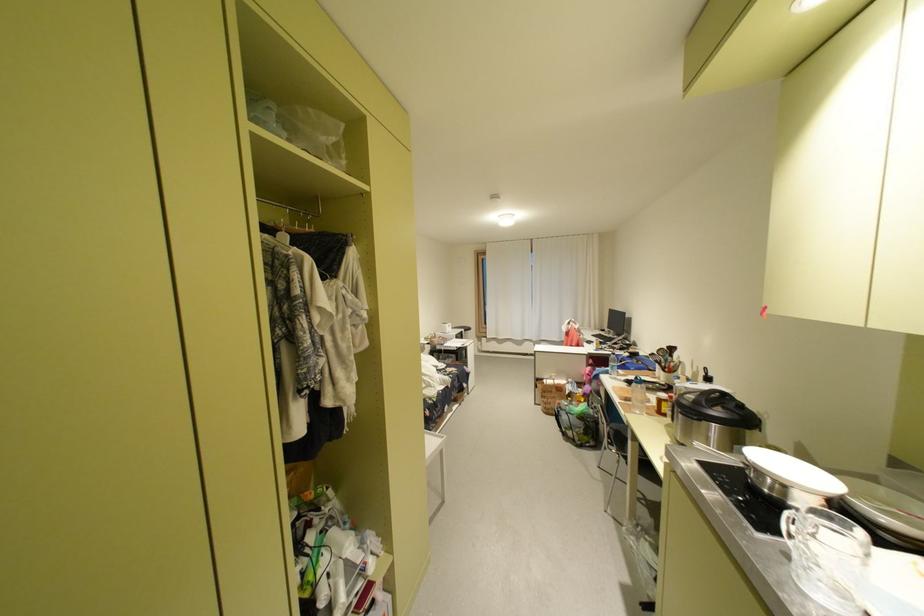
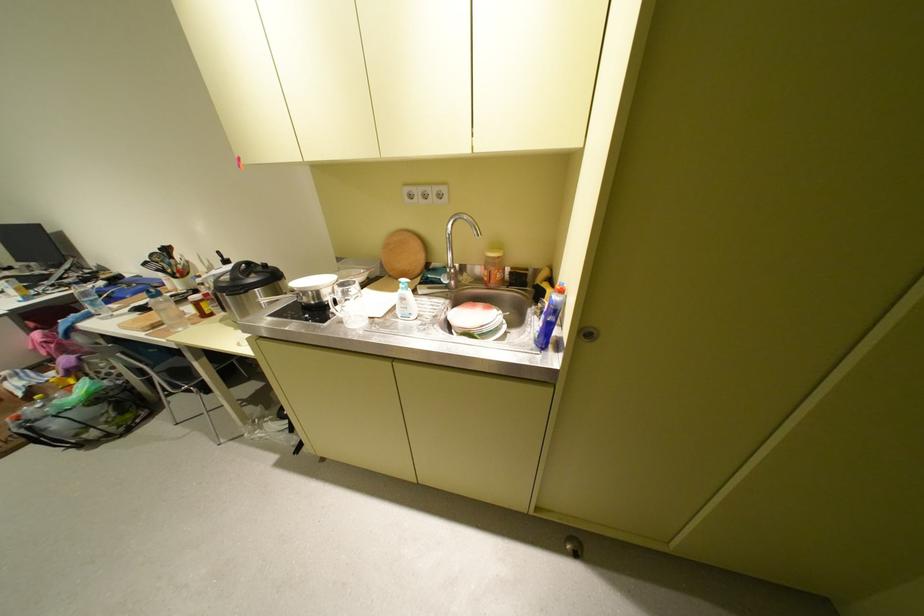
The point at (782, 496) is marked in the first image. Where is the corresponding point in the second image?

(326, 304)